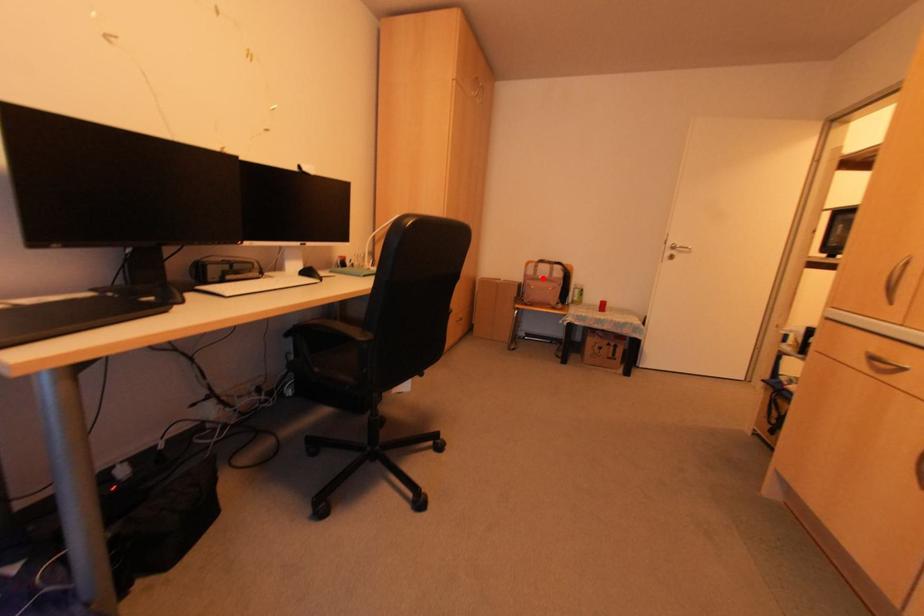
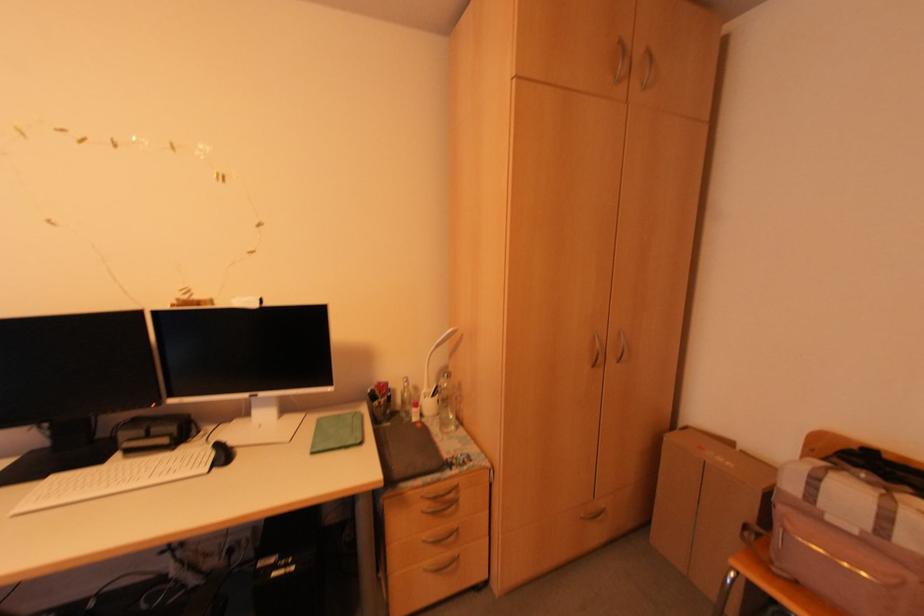
Question: I am providing you with two images of the same scene from different viewpoints. A red point is shown in image1. For the corresponding object point in image2, is it positioned nearer or farther from the camera?

Choices:
 (A) Nearer
 (B) Farther

Answer: (A)